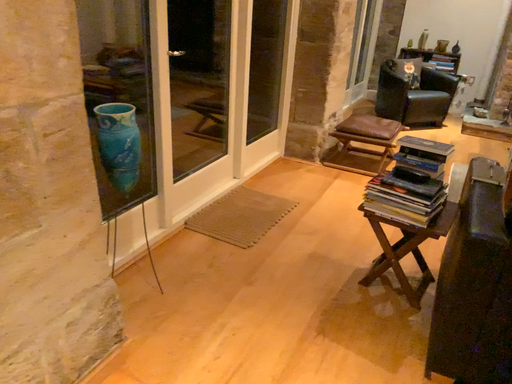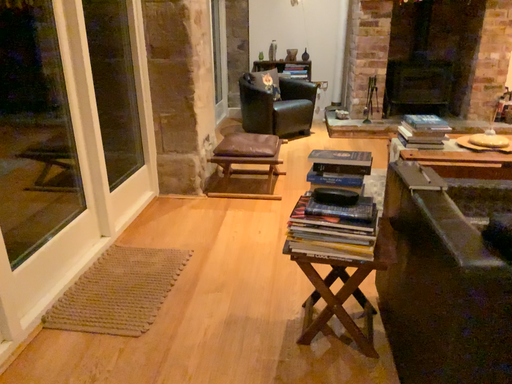
Question: How did the camera likely rotate when shooting the video?

Choices:
 (A) rotated left
 (B) rotated right

Answer: (B)